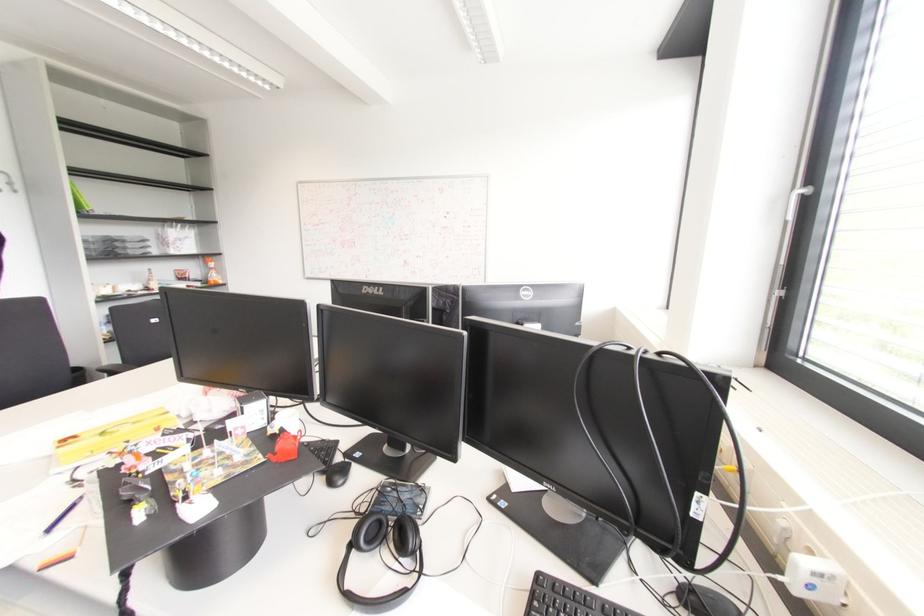
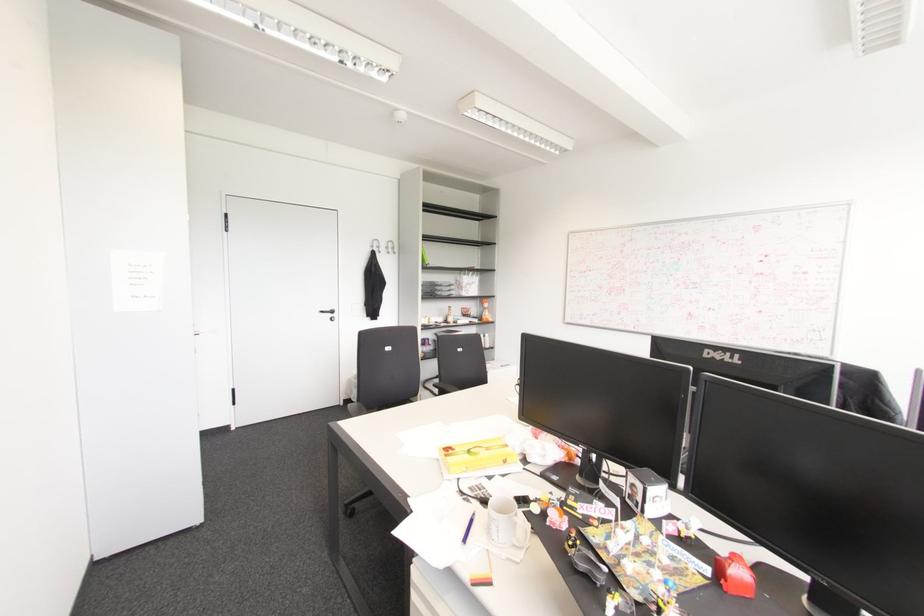
Find the pixel in the second image that matches (211,264) in the first image.

(485, 305)